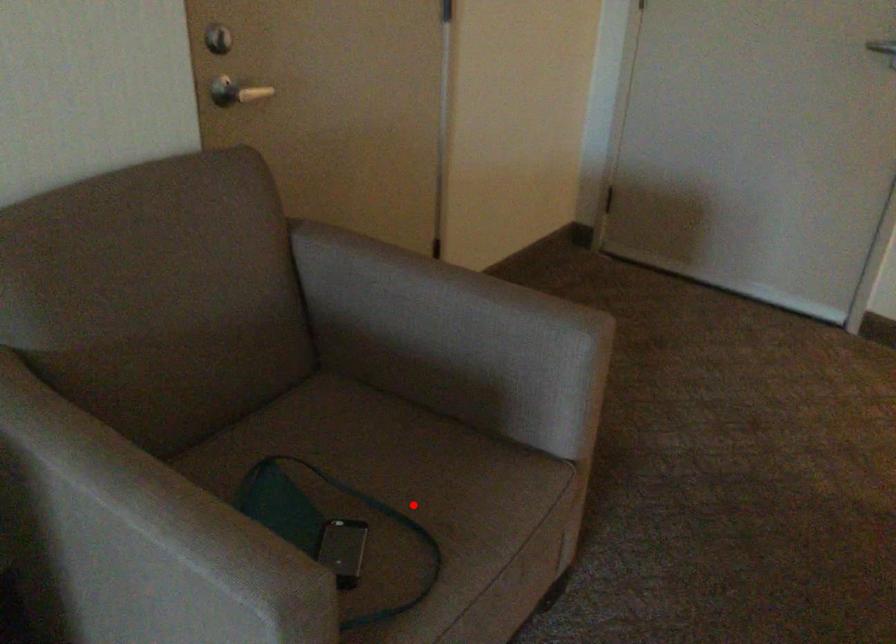
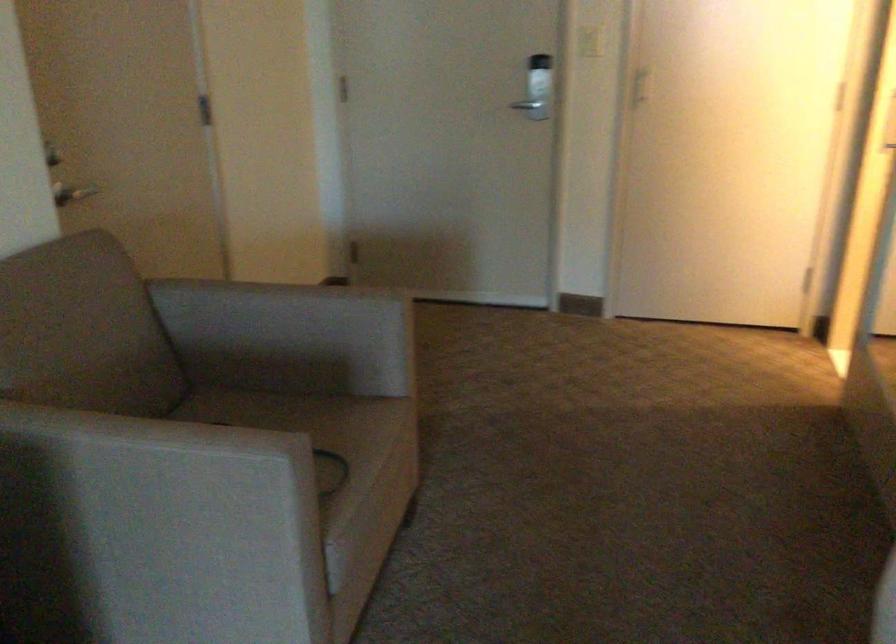
Question: I am providing you with two images of the same scene from different viewpoints. A red point is marked on the first image. Can you still see the location of the red point in image 2?

Choices:
 (A) Yes
 (B) No

Answer: (B)